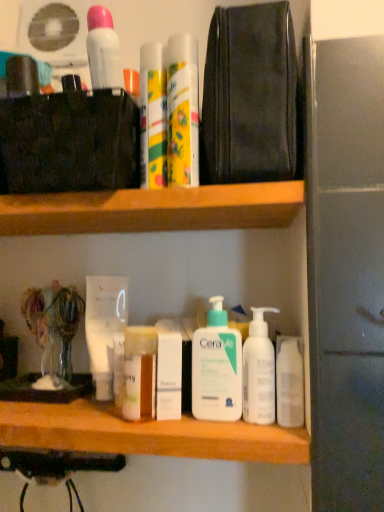
Locate an element on the screen. The height and width of the screenshot is (512, 384). free spot to the left of white pump bottle at center, arranged as the 2th cleaning product when viewed from the left is located at coordinates [155, 422].